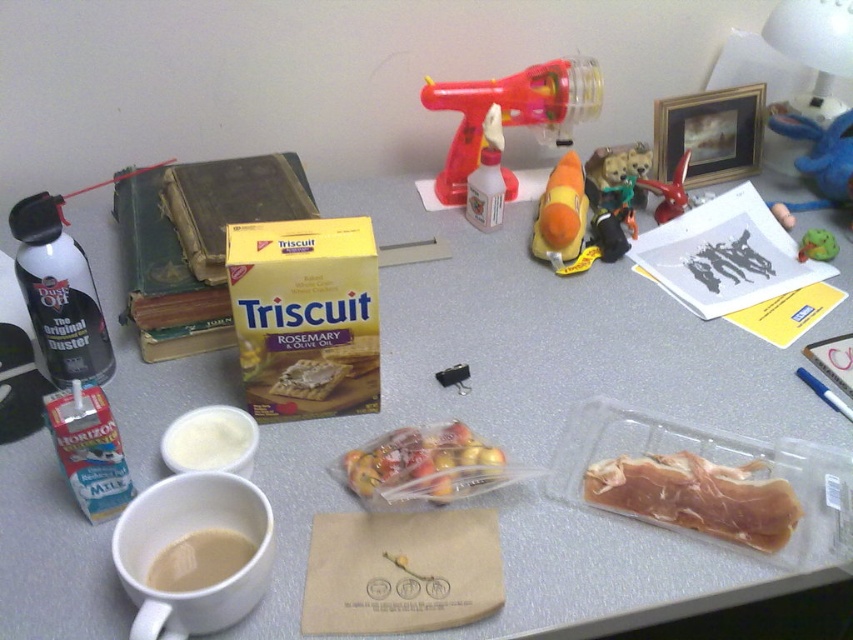
Question: Is the position of orange rubber toy at center more distant than that of green rubber toy at center?

Choices:
 (A) no
 (B) yes

Answer: (A)

Question: Estimate the real-world distances between objects in this image. Which object is farther from the green rubber toy at center?

Choices:
 (A) plush toy at center
 (B) translucent plastic meat at lower right

Answer: (B)

Question: Which point is closer to the camera taking this photo?

Choices:
 (A) (169, 563)
 (B) (415, 481)

Answer: (A)

Question: Among these points, which one is nearest to the camera?

Choices:
 (A) (814, 244)
 (B) (445, 486)
 (C) (236, 538)
 (D) (679, 200)

Answer: (C)

Question: Is translucent plastic meat at lower right bigger than smooth beige coffee at lower left?

Choices:
 (A) no
 (B) yes

Answer: (B)

Question: Is translucent plastic meat at lower right positioned behind smooth beige coffee at lower left?

Choices:
 (A) yes
 (B) no

Answer: (A)